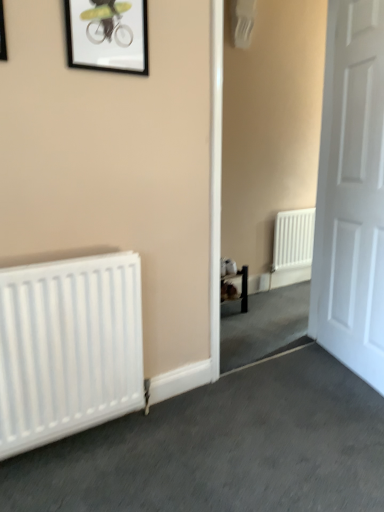
Question: Considering the relative sizes of black matte picture frame at upper center, which ranks as the 2th picture frame in left-to-right order, and matte black picture frame at upper left, marked as the second picture frame in a right-to-left arrangement, in the image provided, is black matte picture frame at upper center, which ranks as the 2th picture frame in left-to-right order, smaller than matte black picture frame at upper left, marked as the second picture frame in a right-to-left arrangement,?

Choices:
 (A) no
 (B) yes

Answer: (A)

Question: Can you confirm if black matte picture frame at upper center, placed as the 2th picture frame when sorted from front to back, is taller than matte black picture frame at upper left, the 2th picture frame when ordered from back to front?

Choices:
 (A) no
 (B) yes

Answer: (B)

Question: Are black matte picture frame at upper center, which ranks as the 2th picture frame in left-to-right order, and matte black picture frame at upper left, the 1th picture frame in the left-to-right sequence, beside each other?

Choices:
 (A) yes
 (B) no

Answer: (B)

Question: Is black matte picture frame at upper center, which ranks as the 2th picture frame in left-to-right order, far away from matte black picture frame at upper left, which ranks as the 1th picture frame in front-to-back order?

Choices:
 (A) yes
 (B) no

Answer: (B)

Question: Does black matte picture frame at upper center, which is counted as the first picture frame, starting from the right, come behind matte black picture frame at upper left, the 2th picture frame when ordered from back to front?

Choices:
 (A) yes
 (B) no

Answer: (A)

Question: Considering the relative sizes of black matte picture frame at upper center, placed as the 2th picture frame when sorted from front to back, and matte black picture frame at upper left, marked as the second picture frame in a right-to-left arrangement, in the image provided, is black matte picture frame at upper center, placed as the 2th picture frame when sorted from front to back, wider than matte black picture frame at upper left, marked as the second picture frame in a right-to-left arrangement,?

Choices:
 (A) yes
 (B) no

Answer: (A)

Question: Is white matte door at right turned away from black matte picture frame at upper center, which is counted as the first picture frame, starting from the right?

Choices:
 (A) no
 (B) yes

Answer: (A)

Question: Does white matte door at right have a greater width compared to black matte picture frame at upper center, placed as the 2th picture frame when sorted from front to back?

Choices:
 (A) yes
 (B) no

Answer: (A)

Question: Is white matte door at right not near black matte picture frame at upper center, the first picture frame when ordered from back to front?

Choices:
 (A) no
 (B) yes

Answer: (B)

Question: Considering the relative sizes of white matte door at right and black matte picture frame at upper center, which is counted as the first picture frame, starting from the right, in the image provided, is white matte door at right smaller than black matte picture frame at upper center, which is counted as the first picture frame, starting from the right,?

Choices:
 (A) yes
 (B) no

Answer: (B)

Question: Would you say white matte door at right contains black matte picture frame at upper center, the first picture frame when ordered from back to front?

Choices:
 (A) yes
 (B) no

Answer: (B)

Question: From a real-world perspective, does white matte door at right stand above black matte picture frame at upper center, which ranks as the 2th picture frame in left-to-right order?

Choices:
 (A) yes
 (B) no

Answer: (B)

Question: Does matte black picture frame at upper left, the 1th picture frame in the left-to-right sequence, appear on the left side of white matte door at right?

Choices:
 (A) no
 (B) yes

Answer: (B)